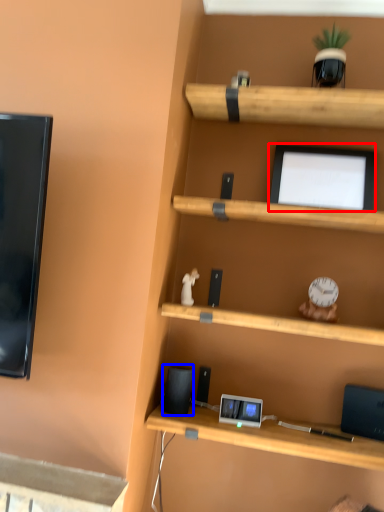
Question: Among these objects, which one is nearest to the camera, computer monitor (highlighted by a red box) or speaker (highlighted by a blue box)?

Choices:
 (A) computer monitor
 (B) speaker

Answer: (B)